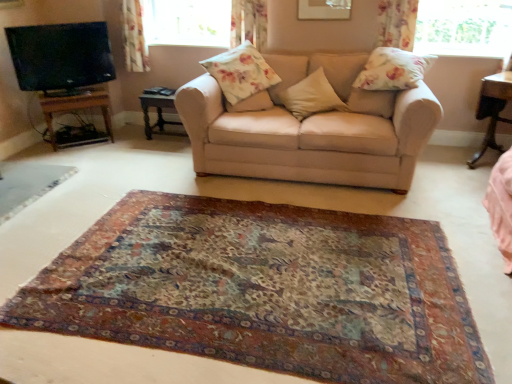
Question: Which direction should I rotate to look at floral fabric pillow at center, which ranks as the 3th pillow in right-to-left order?

Choices:
 (A) left
 (B) right

Answer: (A)

Question: Is wooden table at left, which is counted as the second table, starting from the right, located outside wooden table at left, the 1th table positioned from the left?

Choices:
 (A) yes
 (B) no

Answer: (A)

Question: Does wooden table at left, which is counted as the second table, starting from the right, have a lesser width compared to wooden table at left, the third table in the right-to-left sequence?

Choices:
 (A) no
 (B) yes

Answer: (B)

Question: Can you confirm if wooden table at left, which is counted as the second table, starting from the right, is positioned to the right of wooden table at left, the third table in the right-to-left sequence?

Choices:
 (A) no
 (B) yes

Answer: (B)

Question: From the image's perspective, does wooden table at left, acting as the 2th table starting from the left, appear higher than wooden table at left, the 1th table positioned from the left?

Choices:
 (A) no
 (B) yes

Answer: (B)

Question: From a real-world perspective, does wooden table at left, which is counted as the second table, starting from the right, stand above wooden table at left, the third table in the right-to-left sequence?

Choices:
 (A) yes
 (B) no

Answer: (B)

Question: Could you tell me if wooden table at left, which is counted as the second table, starting from the right, is turned towards wooden table at left, the third table in the right-to-left sequence?

Choices:
 (A) yes
 (B) no

Answer: (B)

Question: Does transparent glass window at upper right, placed as the first window when sorted from front to back, have a lesser width compared to wooden table at left, which is counted as the second table, starting from the right?

Choices:
 (A) no
 (B) yes

Answer: (B)

Question: Can you confirm if transparent glass window at upper right, which is the 1th window in right-to-left order, is smaller than wooden table at left, which is counted as the second table, starting from the right?

Choices:
 (A) yes
 (B) no

Answer: (A)

Question: From a real-world perspective, is transparent glass window at upper right, the 2th window viewed from the left, located beneath wooden table at left, acting as the 2th table starting from the left?

Choices:
 (A) yes
 (B) no

Answer: (B)

Question: Does transparent glass window at upper right, the 2th window viewed from the left, have a greater height compared to wooden table at left, which is counted as the second table, starting from the right?

Choices:
 (A) no
 (B) yes

Answer: (B)

Question: Could wooden table at left, which is counted as the second table, starting from the right, be considered to be inside transparent glass window at upper right, which is the 2th window in back-to-front order?

Choices:
 (A) no
 (B) yes

Answer: (A)

Question: From the image's perspective, would you say transparent glass window at upper right, which is the 1th window in right-to-left order, is positioned over wooden table at left, acting as the 2th table starting from the left?

Choices:
 (A) yes
 (B) no

Answer: (A)

Question: Can you confirm if floral fabric pillow at center, which ranks as the 3th pillow in right-to-left order, is smaller than transparent glass window at upper right, placed as the first window when sorted from front to back?

Choices:
 (A) no
 (B) yes

Answer: (B)